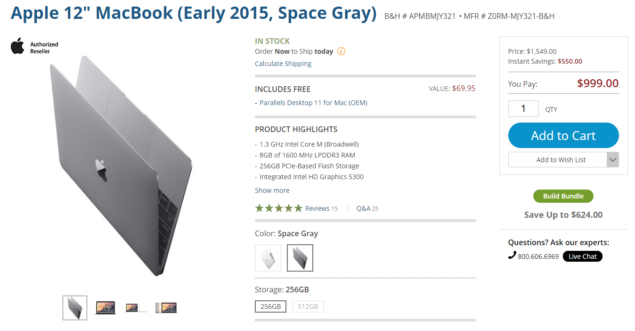
This screenshot has width=635, height=331. I want to click on black keyboard, so click(164, 216).